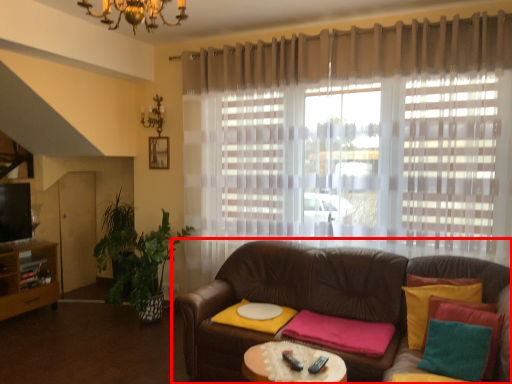
Question: From the image's perspective, considering the relative positions of studio couch (annotated by the red box) and curtain in the image provided, where is studio couch (annotated by the red box) located with respect to the staircase?

Choices:
 (A) below
 (B) above

Answer: (A)